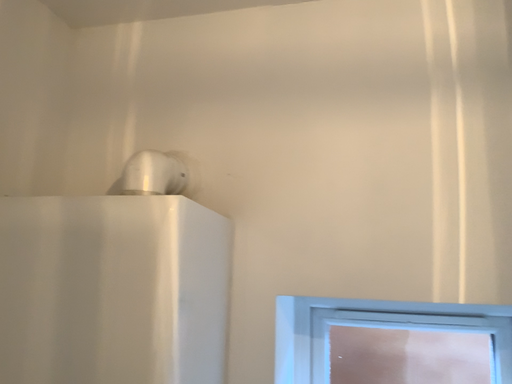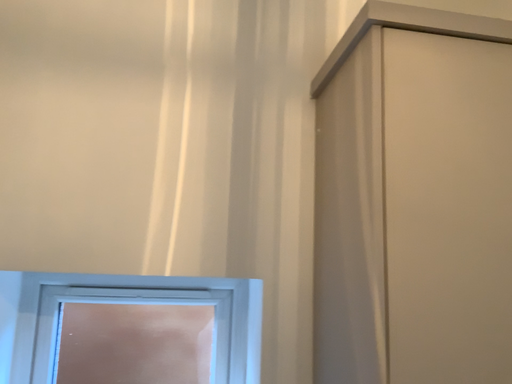
Question: How did the camera likely rotate when shooting the video?

Choices:
 (A) rotated right
 (B) rotated left

Answer: (A)